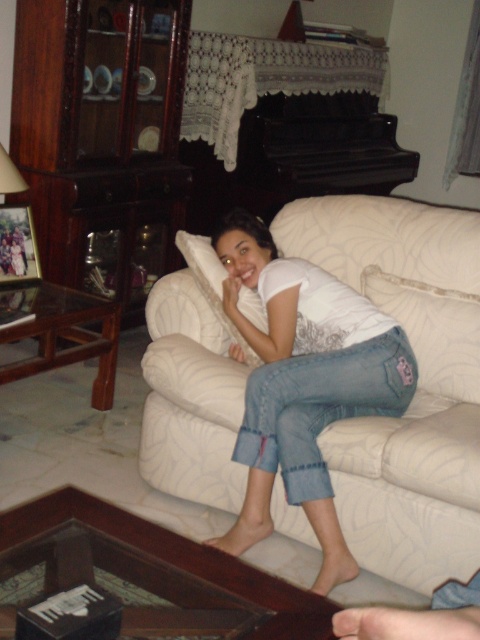
Is white fabric pillow at lower center taller than matte white lampshade at left?

Indeed, white fabric pillow at lower center has a greater height compared to matte white lampshade at left.

Does point (429, 381) lie in front of point (7, 152)?

Yes, it is.

In order to click on white fabric pillow at lower center in this screenshot , I will do `click(432, 330)`.

Between white fabric couch at center and white soft pillow at center, which one has more height?

With more height is white fabric couch at center.

Which is behind, point (427, 536) or point (216, 312)?

Positioned behind is point (216, 312).

Which is in front, point (442, 284) or point (251, 307)?

Point (442, 284) is in front.

Where is `white fabric couch at center`? white fabric couch at center is located at coordinates (418, 381).

From the picture: Can you confirm if white fabric pillow at lower center is smaller than white soft pillow at center?

Yes.

Does white fabric pillow at lower center appear over white soft pillow at center?

No, white fabric pillow at lower center is not above white soft pillow at center.

Is point (393, 280) closer to viewer compared to point (199, 284)?

No.

Locate an element on the screen. The image size is (480, 640). white fabric pillow at lower center is located at coordinates (432, 330).